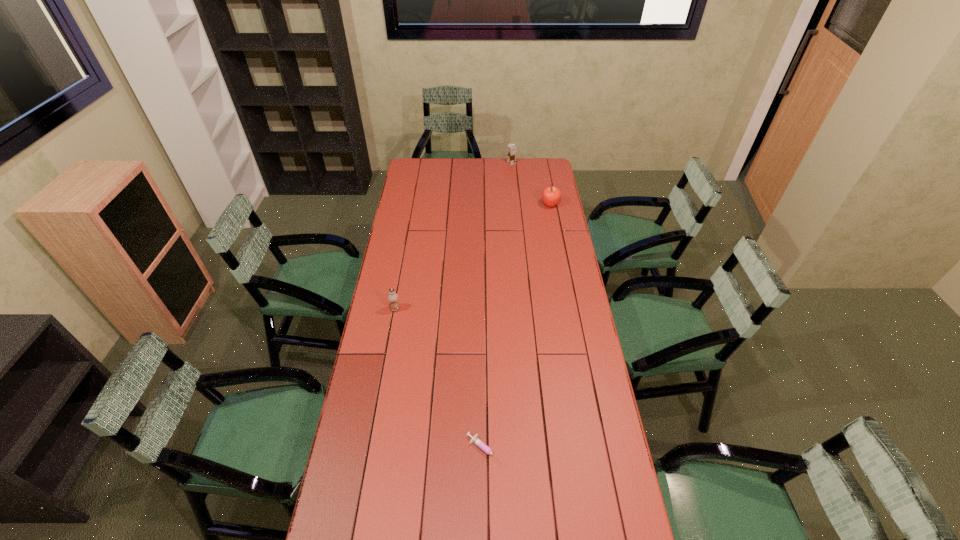
Where is `vacant space in between the right chocolate milk and the shortest object`? The image size is (960, 540). vacant space in between the right chocolate milk and the shortest object is located at coordinates (498, 306).

At what (x,y) coordinates should I click in order to perform the action: click on vacant area that lies between the third object from left to right and the apple. Please return your answer as a coordinate pair (x, y). The image size is (960, 540). Looking at the image, I should click on (531, 184).

Identify the location of vacant area between the nearer chocolate milk and the shortest object. (441, 380).

Identify the location of vacant area that lies between the third nearest object and the farthest object. (531, 184).

Identify the location of free area in between the nearest object and the third nearest object. (517, 327).

This screenshot has height=540, width=960. Identify the location of vacant area that lies between the rightmost object and the farther chocolate milk. (531, 184).

At what (x,y) coordinates should I click in order to perform the action: click on vacant space in between the second nearest object and the rightmost object. Please return your answer as a coordinate pair (x, y). Image resolution: width=960 pixels, height=540 pixels. Looking at the image, I should click on (472, 257).

You are a GUI agent. You are given a task and a screenshot of the screen. Output one action in this format:
    pyautogui.click(x=<x>, y=<y>)
    Task: Click on the free point between the nearest object and the apple
    The width and height of the screenshot is (960, 540).
    Given the screenshot: What is the action you would take?
    pyautogui.click(x=517, y=327)

Where is `the closest object to the apple`? The width and height of the screenshot is (960, 540). the closest object to the apple is located at coordinates (511, 149).

Point out which object is positioned as the third nearest to the leftmost object. Please provide its 2D coordinates. Your answer should be formatted as a tuple, i.e. [(x, y)], where the tuple contains the x and y coordinates of a point satisfying the conditions above.

[(511, 149)]